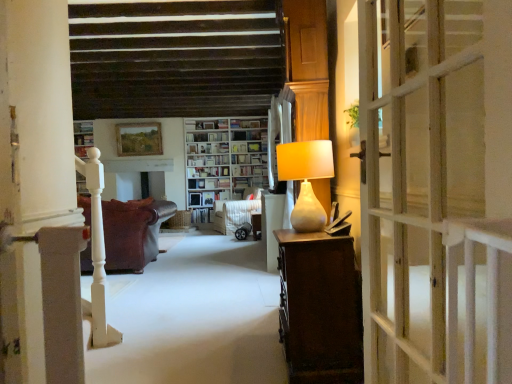
Question: Is leather couch at left in contact with white wooden bookcase at center?

Choices:
 (A) no
 (B) yes

Answer: (A)

Question: From a real-world perspective, is leather couch at left located higher than white wooden bookcase at center?

Choices:
 (A) yes
 (B) no

Answer: (B)

Question: Is leather couch at left at the right side of white wooden bookcase at center?

Choices:
 (A) no
 (B) yes

Answer: (A)

Question: Is leather couch at left positioned with its back to white wooden bookcase at center?

Choices:
 (A) yes
 (B) no

Answer: (B)

Question: Can you confirm if leather couch at left is smaller than white wooden bookcase at center?

Choices:
 (A) no
 (B) yes

Answer: (B)

Question: Which is correct: white wooden door at right is inside matte beige lamp at right, or outside of it?

Choices:
 (A) outside
 (B) inside

Answer: (A)

Question: From a real-world perspective, is white wooden door at right above or below matte beige lamp at right?

Choices:
 (A) above
 (B) below

Answer: (B)

Question: From the image's perspective, is white wooden door at right positioned above or below matte beige lamp at right?

Choices:
 (A) above
 (B) below

Answer: (B)

Question: Considering the positions of white wooden door at right and matte beige lamp at right in the image, is white wooden door at right wider or thinner than matte beige lamp at right?

Choices:
 (A) thin
 (B) wide

Answer: (A)

Question: Considering the positions of white wooden door at right and white glossy bookshelf at center, which ranks as the 2th shelf in bottom-to-top order, in the image, is white wooden door at right bigger or smaller than white glossy bookshelf at center, which ranks as the 2th shelf in bottom-to-top order,?

Choices:
 (A) big
 (B) small

Answer: (A)

Question: From a real-world perspective, is white wooden door at right physically located above or below white glossy bookshelf at center, which ranks as the 2th shelf in bottom-to-top order?

Choices:
 (A) above
 (B) below

Answer: (B)

Question: Would you say white wooden door at right is inside or outside white glossy bookshelf at center, which ranks as the 2th shelf in bottom-to-top order?

Choices:
 (A) outside
 (B) inside

Answer: (A)

Question: Is point (503, 127) closer or farther from the camera than point (192, 135)?

Choices:
 (A) closer
 (B) farther

Answer: (A)

Question: In terms of width, does matte beige lamp at right look wider or thinner when compared to velvet brown armchair at center?

Choices:
 (A) thin
 (B) wide

Answer: (A)

Question: Is point (316, 205) positioned closer to the camera than point (224, 200)?

Choices:
 (A) farther
 (B) closer

Answer: (B)